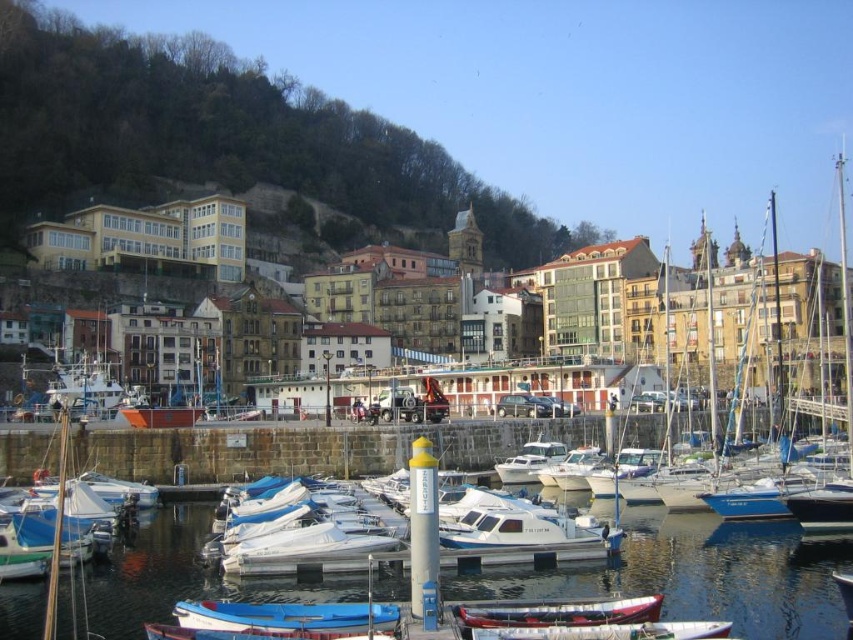
Question: Can you confirm if wooden canoe at center is positioned to the left of white plastic boat at center?

Choices:
 (A) yes
 (B) no

Answer: (A)

Question: Considering the real-world distances, which object is farthest from the white plastic boats at center?

Choices:
 (A) white plastic boat at center
 (B) wooden canoe at center

Answer: (A)

Question: Which object is positioned closest to the white plastic boats at center?

Choices:
 (A) wooden canoe at center
 (B) green leafy hillside at upper left
 (C) white plastic boat at center

Answer: (A)

Question: Does white plastic boats at center have a smaller size compared to wooden canoe at center?

Choices:
 (A) yes
 (B) no

Answer: (B)

Question: Can you confirm if green leafy hillside at upper left is bigger than white plastic boat at center?

Choices:
 (A) no
 (B) yes

Answer: (B)

Question: Which object appears farthest from the camera in this image?

Choices:
 (A) white plastic boat at center
 (B) white plastic boats at center
 (C) green leafy hillside at upper left

Answer: (C)